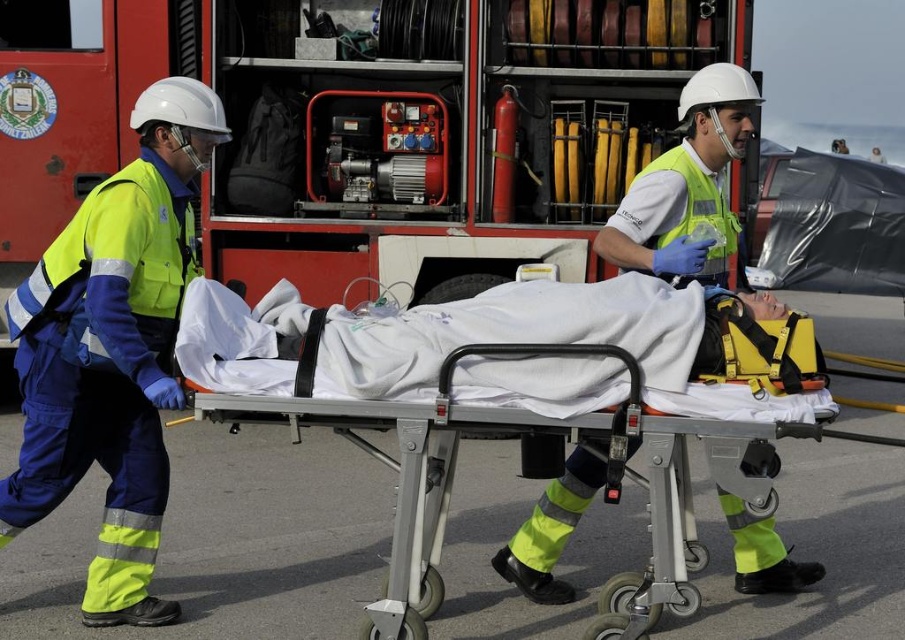
Is yellow reflective uniform at left smaller than white fabric stretcher at center?

No.

Who is shorter, yellow reflective uniform at left or white fabric stretcher at center?

white fabric stretcher at center

Is point (35, 365) more distant than point (551, 413)?

Yes, point (35, 365) is behind point (551, 413).

What are the coordinates of `yellow reflective uniform at left` in the screenshot? It's located at (112, 349).